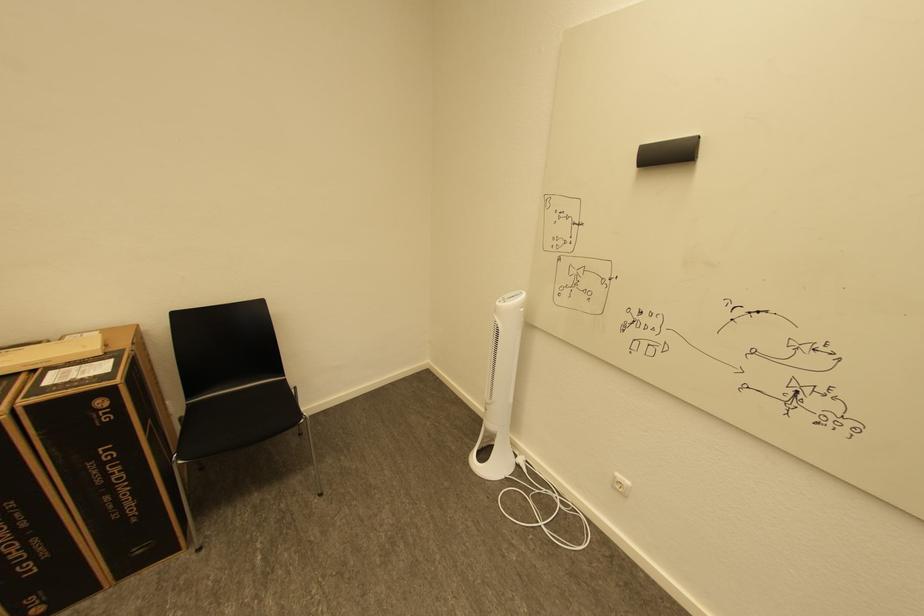
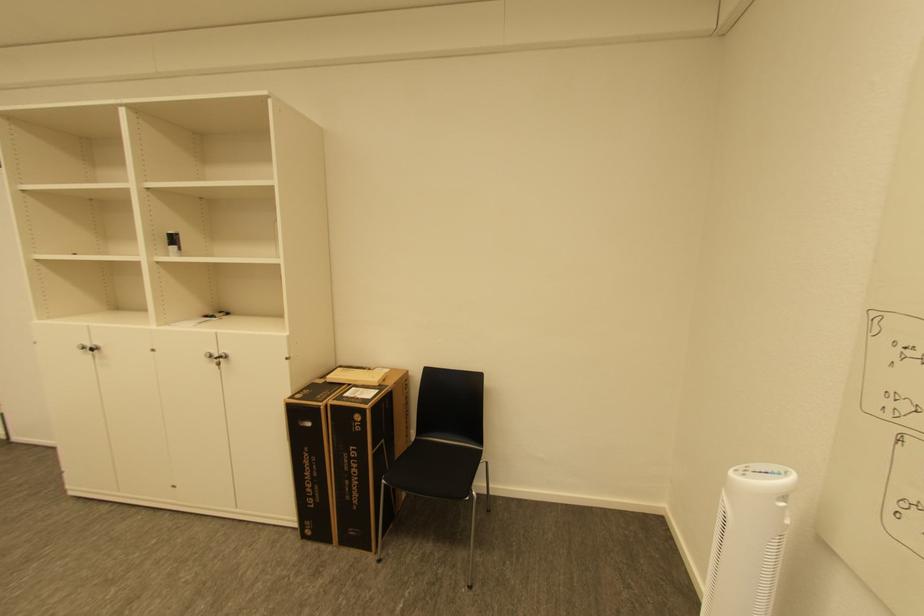
Where in the second image is the point corresponding to [107,403] from the first image?

(363, 418)